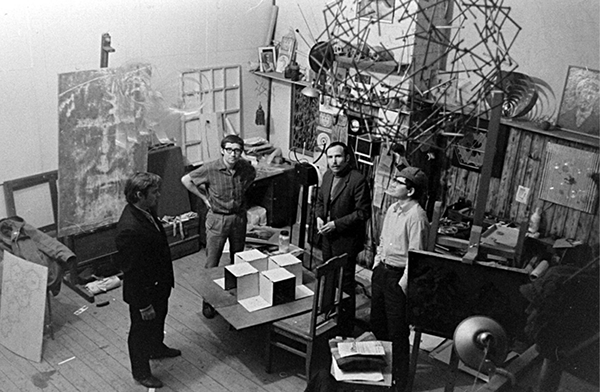
The height and width of the screenshot is (392, 600). Find the location of `switch`. switch is located at coordinates (518, 194).